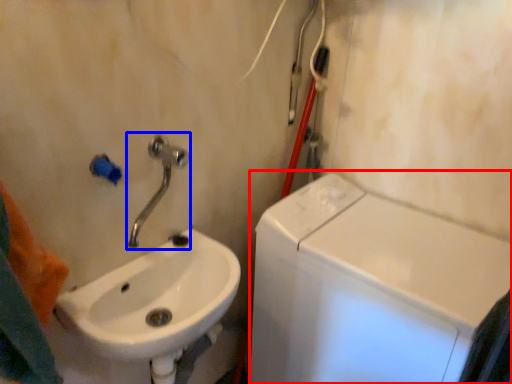
Question: Which object is closer to the camera taking this photo, washing machine (highlighted by a red box) or tap (highlighted by a blue box)?

Choices:
 (A) washing machine
 (B) tap

Answer: (B)